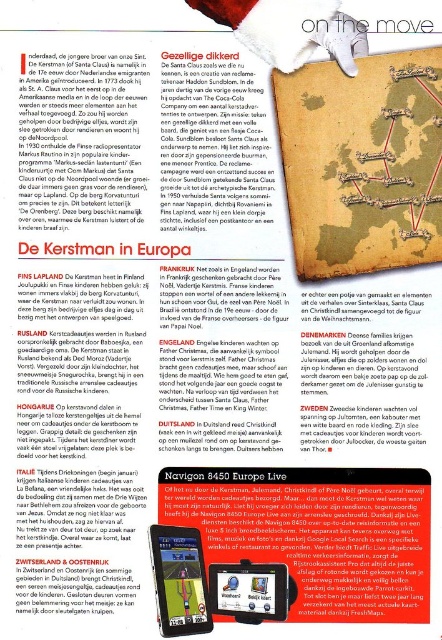
Question: Considering the relative positions of green paper map at upper center and matte black laptop at upper center in the image provided, where is green paper map at upper center located with respect to matte black laptop at upper center?

Choices:
 (A) left
 (B) right

Answer: (B)

Question: Does matte black laptop at upper center have a greater width compared to matte black santa claus at upper center?

Choices:
 (A) no
 (B) yes

Answer: (B)

Question: Which of the following is the farthest from the observer?

Choices:
 (A) (335, 586)
 (B) (435, 156)

Answer: (A)

Question: Which object appears closest to the camera in this image?

Choices:
 (A) white paper text at upper center
 (B) matte black laptop at upper center
 (C) matte black santa claus at upper center
 (D) green paper map at upper center

Answer: (A)

Question: Is matte black laptop at upper center thinner than white paper text at upper center?

Choices:
 (A) yes
 (B) no

Answer: (B)

Question: Which is nearer to the white paper text at upper center?

Choices:
 (A) matte black laptop at upper center
 (B) matte black santa claus at upper center
 (C) green paper map at upper center

Answer: (A)